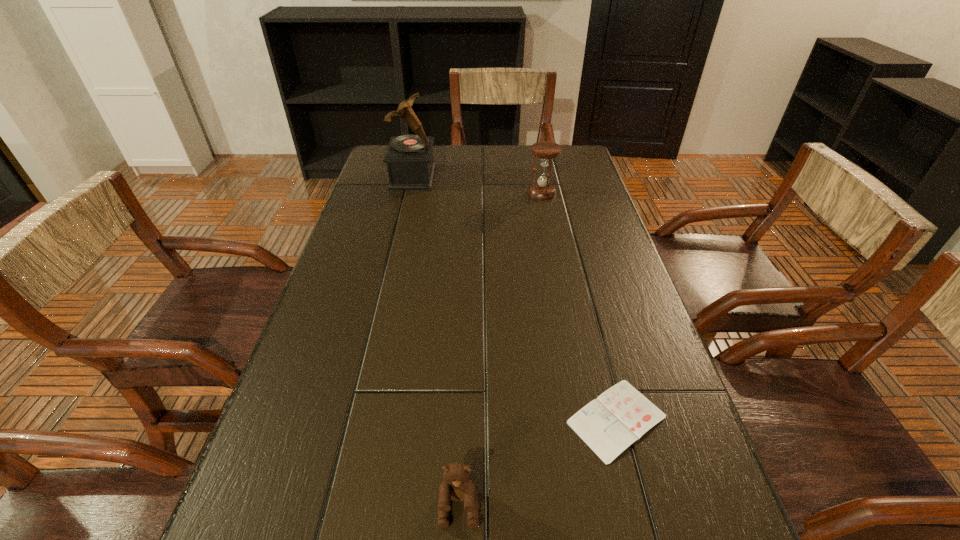
Locate an element on the screen. The image size is (960, 540). free space that is in between the phonograph_record and the diary is located at coordinates (515, 298).

The image size is (960, 540). I want to click on vacant space that is in between the teddy bear and the shortest object, so click(x=538, y=463).

At what (x,y) coordinates should I click in order to perform the action: click on free space between the shortest object and the hourglass. Please return your answer as a coordinate pair (x, y). The width and height of the screenshot is (960, 540). Looking at the image, I should click on (580, 306).

Find the location of a particular element. vacant space in between the third object from right to left and the hourglass is located at coordinates (501, 350).

Where is `vacant area that lies between the diary and the tallest object`? This screenshot has width=960, height=540. vacant area that lies between the diary and the tallest object is located at coordinates (515, 298).

You are a GUI agent. You are given a task and a screenshot of the screen. Output one action in this format:
    pyautogui.click(x=<x>, y=<y>)
    Task: Click on the blank region between the shortest object and the teddy bear
    Image resolution: width=960 pixels, height=540 pixels.
    Given the screenshot: What is the action you would take?
    pyautogui.click(x=538, y=463)

The height and width of the screenshot is (540, 960). What are the coordinates of `free point between the tallest object and the third farthest object` in the screenshot? It's located at (515, 298).

In order to click on vacant space that's between the teddy bear and the hourglass in this screenshot , I will do `click(501, 350)`.

Where is `the closest object relative to the phonograph_record`? the closest object relative to the phonograph_record is located at coordinates (545, 151).

The height and width of the screenshot is (540, 960). In order to click on object that is the nearest to the hourglass in this screenshot , I will do `click(409, 158)`.